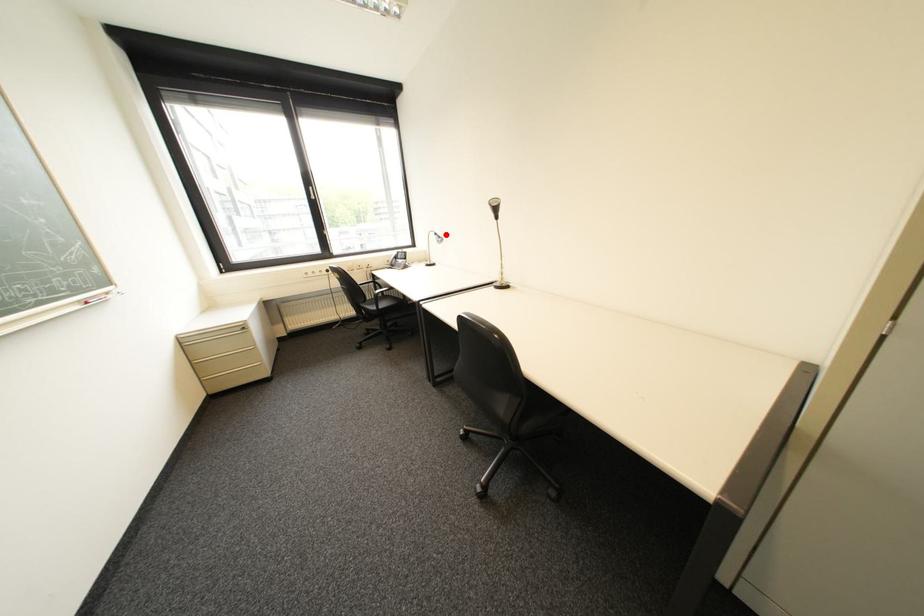
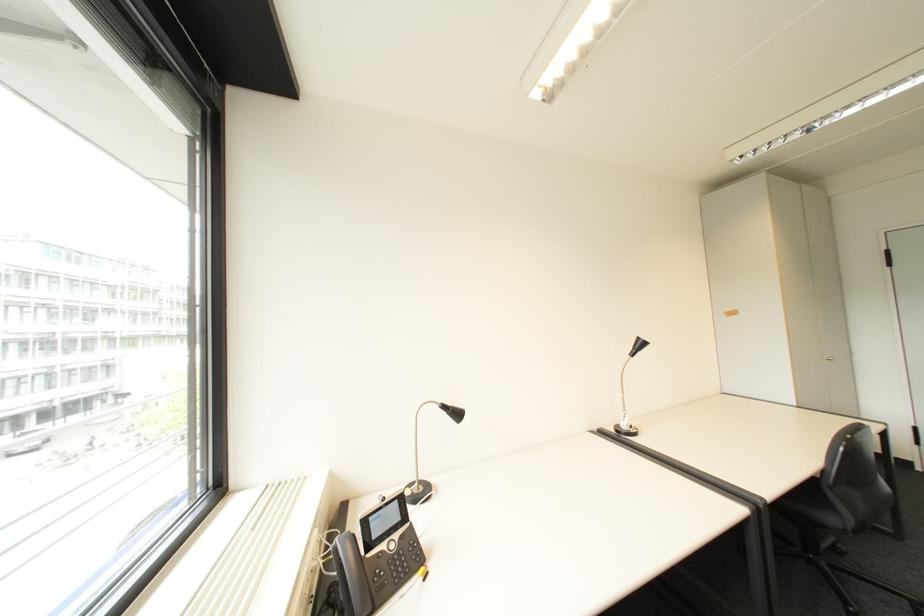
Where in the second image is the point corresponding to the highlighted location from the first image?

(455, 407)